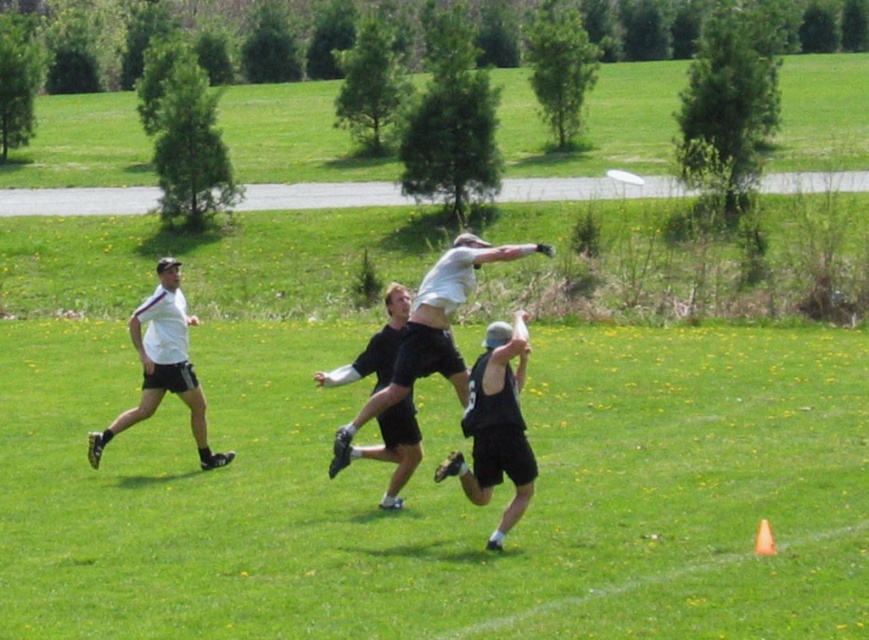
Question: Which object is positioned closest to the white matte shirt at left?

Choices:
 (A) white matte shirt at center
 (B) black matte tank top at center
 (C) white matte frisbee at upper center

Answer: (B)

Question: Is white matte shirt at left positioned at the back of white matte frisbee at upper center?

Choices:
 (A) yes
 (B) no

Answer: (B)

Question: Can you confirm if black matte tank top at center is positioned to the right of black matte shorts at center?

Choices:
 (A) yes
 (B) no

Answer: (A)

Question: Which of the following is the closest to the observer?

Choices:
 (A) white matte shirt at center
 (B) black matte shorts at center
 (C) black matte tank top at center

Answer: (C)

Question: Based on their relative distances, which object is nearer to the white matte frisbee at upper center?

Choices:
 (A) white matte shirt at center
 (B) black matte tank top at center
 (C) white matte shirt at left

Answer: (A)

Question: Is white matte shirt at left closer to the viewer compared to white matte frisbee at upper center?

Choices:
 (A) yes
 (B) no

Answer: (A)